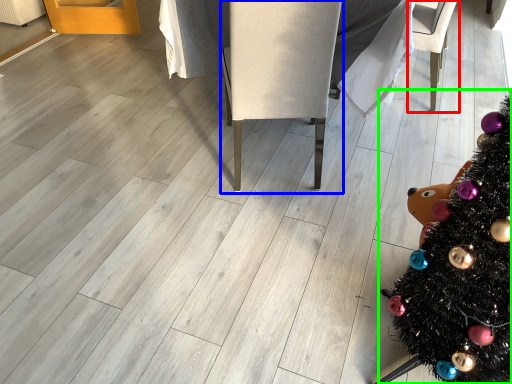
Question: Based on their relative distances, which object is farther from armchair (highlighted by a red box)? Choose from armchair (highlighted by a blue box) and christmas tree (highlighted by a green box).

Choices:
 (A) armchair
 (B) christmas tree

Answer: (B)